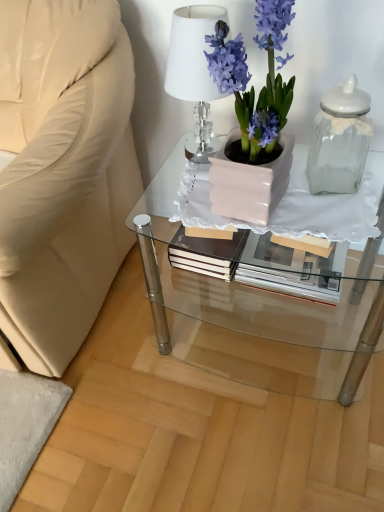
Where is `free point in front of matte white glass table at center`? The image size is (384, 512). free point in front of matte white glass table at center is located at coordinates (260, 441).